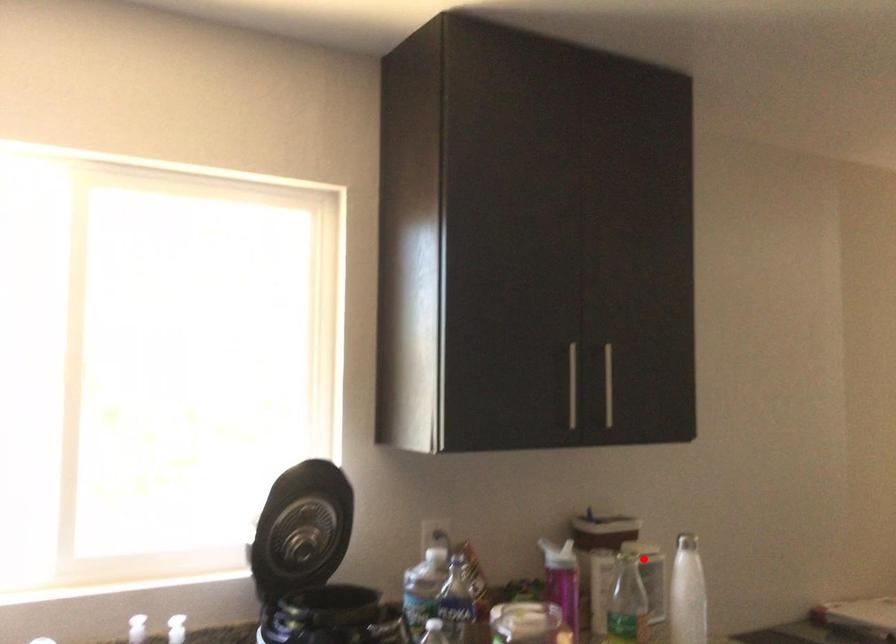
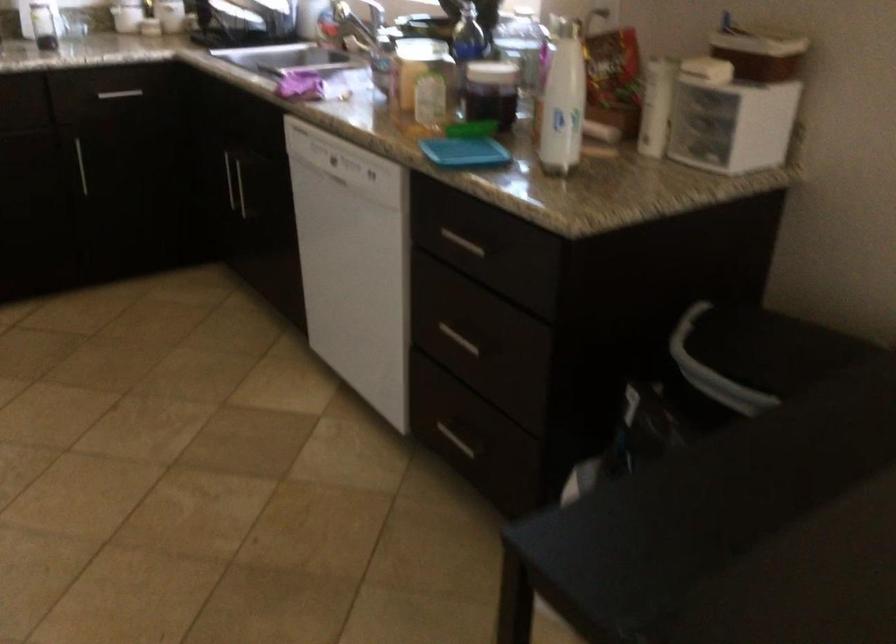
Where in the second image is the point corresponding to the highlighted location from the first image?

(563, 100)